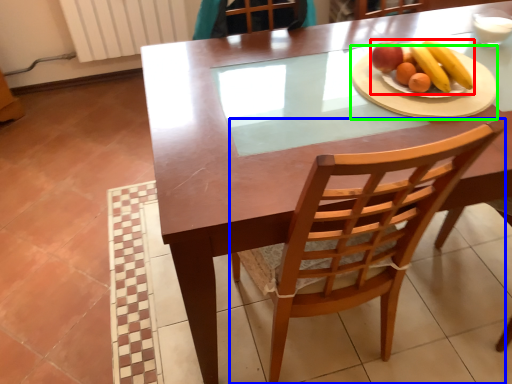
Question: Which object is positioned farthest from fruit dish (highlighted by a red box)? Select from chair (highlighted by a blue box) and platter (highlighted by a green box).

Choices:
 (A) chair
 (B) platter

Answer: (A)